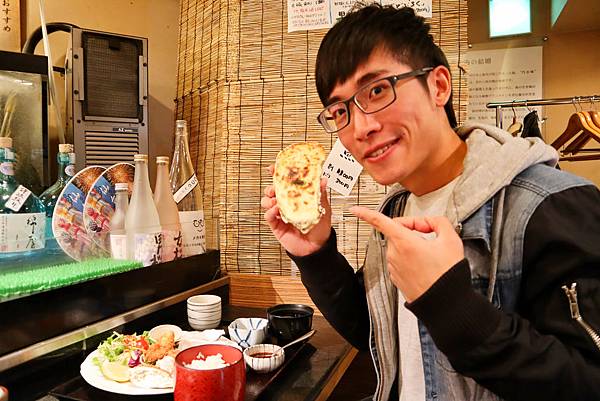
You are a GUI agent. You are given a task and a screenshot of the screen. Output one action in this format:
    pyautogui.click(x=<x>, y=<y>)
    Task: Click on the corks
    Image resolution: width=600 pixels, height=401 pixels.
    Given the screenshot: What is the action you would take?
    pyautogui.click(x=3, y=141), pyautogui.click(x=68, y=149)